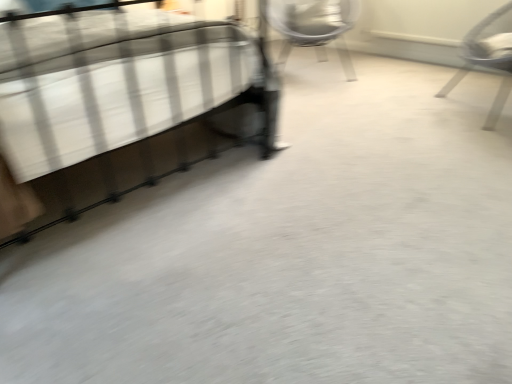
Measure the distance between metallic silver bed at left and camera.

A distance of 1.25 meters exists between metallic silver bed at left and camera.

This screenshot has width=512, height=384. In order to click on metallic silver bed at left in this screenshot , I will do `click(122, 87)`.

Find the location of a particular element. This screenshot has width=512, height=384. metallic silver chair at upper center, which appears as the first chair when viewed from the left is located at coordinates (314, 27).

Find the location of a particular element. The width and height of the screenshot is (512, 384). metallic silver chair at right, which ranks as the second chair in back-to-front order is located at coordinates (487, 61).

Which chair is the 1st one when counting from the back of the metallic silver bed at left? Please provide its 2D coordinates.

[(487, 61)]

Considering the sizes of metallic silver bed at left and metallic silver chair at right, the 2th chair viewed from the left, in the image, is metallic silver bed at left wider or thinner than metallic silver chair at right, the 2th chair viewed from the left,?

Clearly, metallic silver bed at left has more width compared to metallic silver chair at right, the 2th chair viewed from the left.

From the image's perspective, does metallic silver bed at left appear lower than metallic silver chair at right, arranged as the 1th chair when viewed from the front?

Yes.

Is metallic silver chair at right, arranged as the 1th chair when viewed from the front, shorter than metallic silver chair at upper center, which is the 2th chair in front-to-back order?

No, metallic silver chair at right, arranged as the 1th chair when viewed from the front, is not shorter than metallic silver chair at upper center, which is the 2th chair in front-to-back order.

From a real-world perspective, is metallic silver chair at right, the 2th chair viewed from the left, positioned above or below metallic silver chair at upper center, which appears as the first chair when viewed from the left?

metallic silver chair at right, the 2th chair viewed from the left, is above metallic silver chair at upper center, which appears as the first chair when viewed from the left.

Considering the sizes of objects metallic silver chair at right, the 2th chair viewed from the left, and metallic silver chair at upper center, which appears as the first chair when viewed from the left, in the image provided, who is smaller, metallic silver chair at right, the 2th chair viewed from the left, or metallic silver chair at upper center, which appears as the first chair when viewed from the left,?

With smaller size is metallic silver chair at right, the 2th chair viewed from the left.

Could you tell me if metallic silver bed at left is facing metallic silver chair at upper center, which is the 2th chair in front-to-back order?

No, metallic silver bed at left is not aimed at metallic silver chair at upper center, which is the 2th chair in front-to-back order.

Which of these two, metallic silver bed at left or metallic silver chair at upper center, which is the 2th chair in front-to-back order, is wider?

Wider between the two is metallic silver bed at left.

Is the position of metallic silver bed at left less distant than that of metallic silver chair at upper center, the second chair when ordered from right to left?

Yes, it is in front of metallic silver chair at upper center, the second chair when ordered from right to left.

Locate an element on the screen. This screenshot has height=384, width=512. bed on the left of metallic silver chair at upper center, the second chair when ordered from right to left is located at coordinates (122, 87).

Can you tell me how much metallic silver chair at right, the 2th chair viewed from the left, and metallic silver bed at left differ in facing direction?

The facing directions of metallic silver chair at right, the 2th chair viewed from the left, and metallic silver bed at left are 125 degrees apart.

Is metallic silver chair at right, which appears as the 1th chair when viewed from the right, aimed at metallic silver bed at left?

Yes, metallic silver chair at right, which appears as the 1th chair when viewed from the right, is turned towards metallic silver bed at left.

Is there a large distance between metallic silver chair at right, which appears as the 1th chair when viewed from the right, and metallic silver bed at left?

metallic silver chair at right, which appears as the 1th chair when viewed from the right, is positioned a significant distance from metallic silver bed at left.

Is metallic silver chair at right, which ranks as the second chair in back-to-front order, bigger than metallic silver bed at left?

Actually, metallic silver chair at right, which ranks as the second chair in back-to-front order, might be smaller than metallic silver bed at left.

In the scene shown: Considering the positions of objects metallic silver chair at upper center, which is the 2th chair in front-to-back order, and metallic silver bed at left in the image provided, who is in front, metallic silver chair at upper center, which is the 2th chair in front-to-back order, or metallic silver bed at left?

metallic silver bed at left is closer to the camera.

Is point (338, 7) positioned behind point (36, 13)?

Yes, point (338, 7) is farther from viewer.

Would you say metallic silver chair at upper center, the second chair when ordered from right to left, is to the left or to the right of metallic silver bed at left in the picture?

Clearly, metallic silver chair at upper center, the second chair when ordered from right to left, is on the right of metallic silver bed at left in the image.

Identify the location of bed located below the metallic silver chair at upper center, marked as the 1th chair in a back-to-front arrangement (from the image's perspective). The height and width of the screenshot is (384, 512). (122, 87).

Considering the sizes of objects metallic silver chair at upper center, which appears as the first chair when viewed from the left, and metallic silver chair at right, which ranks as the second chair in back-to-front order, in the image provided, who is shorter, metallic silver chair at upper center, which appears as the first chair when viewed from the left, or metallic silver chair at right, which ranks as the second chair in back-to-front order,?

metallic silver chair at upper center, which appears as the first chair when viewed from the left, is shorter.

Does point (280, 1) come in front of point (492, 124)?

No.

Is metallic silver chair at upper center, which is the 2th chair in front-to-back order, next to metallic silver chair at right, the 2th chair viewed from the left, and touching it?

They are not placed beside each other.

I want to click on bed lying below the metallic silver chair at right, arranged as the 1th chair when viewed from the front (from the image's perspective), so click(122, 87).

Locate an element on the screen. chair above the metallic silver chair at upper center, the second chair when ordered from right to left (from a real-world perspective) is located at coordinates (487, 61).

Which object lies nearer to the anchor point metallic silver chair at right, which appears as the 1th chair when viewed from the right, metallic silver bed at left or metallic silver chair at upper center, the second chair when ordered from right to left?

metallic silver chair at upper center, the second chair when ordered from right to left, is closer to metallic silver chair at right, which appears as the 1th chair when viewed from the right.

Looking at the image, which one is located closer to metallic silver bed at left, metallic silver chair at right, arranged as the 1th chair when viewed from the front, or metallic silver chair at upper center, the second chair when ordered from right to left?

Among the two, metallic silver chair at right, arranged as the 1th chair when viewed from the front, is located nearer to metallic silver bed at left.

Estimate the real-world distances between objects in this image. Which object is further from metallic silver bed at left, metallic silver chair at upper center, marked as the 1th chair in a back-to-front arrangement, or metallic silver chair at right, the 2th chair viewed from the left?

metallic silver chair at upper center, marked as the 1th chair in a back-to-front arrangement.

From the image, which object appears to be nearer to metallic silver chair at right, the 2th chair viewed from the left, metallic silver chair at upper center, the second chair when ordered from right to left, or metallic silver bed at left?

The object closer to metallic silver chair at right, the 2th chair viewed from the left, is metallic silver chair at upper center, the second chair when ordered from right to left.

When comparing their distances from metallic silver chair at upper center, which appears as the first chair when viewed from the left, does metallic silver chair at right, arranged as the 1th chair when viewed from the front, or metallic silver bed at left seem closer?

metallic silver chair at right, arranged as the 1th chair when viewed from the front, lies closer to metallic silver chair at upper center, which appears as the first chair when viewed from the left, than the other object.

Based on their spatial positions, is metallic silver bed at left or metallic silver chair at right, which appears as the 1th chair when viewed from the right, closer to metallic silver chair at upper center, marked as the 1th chair in a back-to-front arrangement?

Based on the image, metallic silver chair at right, which appears as the 1th chair when viewed from the right, appears to be nearer to metallic silver chair at upper center, marked as the 1th chair in a back-to-front arrangement.

You are a GUI agent. You are given a task and a screenshot of the screen. Output one action in this format:
    pyautogui.click(x=<x>, y=<y>)
    Task: Click on the chair located between metallic silver bed at left and metallic silver chair at right, arranged as the 1th chair when viewed from the front, in the left-right direction
    The width and height of the screenshot is (512, 384).
    Given the screenshot: What is the action you would take?
    pyautogui.click(x=314, y=27)